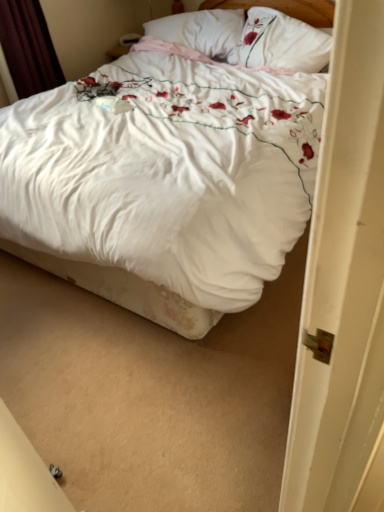
Question: Considering the relative sizes of white floral duvet at center and dark red velvet curtain at upper left in the image provided, is white floral duvet at center shorter than dark red velvet curtain at upper left?

Choices:
 (A) yes
 (B) no

Answer: (B)

Question: From the image's perspective, is white floral duvet at center beneath dark red velvet curtain at upper left?

Choices:
 (A) yes
 (B) no

Answer: (A)

Question: From the image's perspective, would you say white floral duvet at center is positioned over dark red velvet curtain at upper left?

Choices:
 (A) yes
 (B) no

Answer: (B)

Question: Is white floral duvet at center oriented away from dark red velvet curtain at upper left?

Choices:
 (A) yes
 (B) no

Answer: (B)

Question: Is white floral duvet at center positioned before dark red velvet curtain at upper left?

Choices:
 (A) yes
 (B) no

Answer: (A)

Question: Considering their positions, is white soft pillow at upper center, which is the 1th pillow in left-to-right order, located in front of or behind white floral pillow at upper center, placed as the first pillow when sorted from right to left?

Choices:
 (A) front
 (B) behind

Answer: (B)

Question: From the image's perspective, is white soft pillow at upper center, which is the 1th pillow in left-to-right order, above or below white floral pillow at upper center, which ranks as the second pillow in left-to-right order?

Choices:
 (A) below
 (B) above

Answer: (B)

Question: Is white soft pillow at upper center, which is the 1th pillow in left-to-right order, bigger or smaller than white floral pillow at upper center, placed as the first pillow when sorted from right to left?

Choices:
 (A) small
 (B) big

Answer: (B)

Question: Is white soft pillow at upper center, which is the 1th pillow in left-to-right order, to the left or to the right of white floral pillow at upper center, placed as the first pillow when sorted from right to left, in the image?

Choices:
 (A) right
 (B) left

Answer: (B)

Question: Considering the positions of white soft pillow at upper center, which is the 1th pillow in left-to-right order, and dark red velvet curtain at upper left in the image, is white soft pillow at upper center, which is the 1th pillow in left-to-right order, bigger or smaller than dark red velvet curtain at upper left?

Choices:
 (A) small
 (B) big

Answer: (A)

Question: From a real-world perspective, is white soft pillow at upper center, which is the 1th pillow in left-to-right order, positioned above or below dark red velvet curtain at upper left?

Choices:
 (A) above
 (B) below

Answer: (B)

Question: In terms of width, does white soft pillow at upper center, which is the 1th pillow in left-to-right order, look wider or thinner when compared to dark red velvet curtain at upper left?

Choices:
 (A) wide
 (B) thin

Answer: (A)

Question: Relative to dark red velvet curtain at upper left, is white soft pillow at upper center, which is the 1th pillow in left-to-right order, in front or behind?

Choices:
 (A) front
 (B) behind

Answer: (B)

Question: Considering the relative positions of white floral duvet at center and dark red velvet curtain at upper left in the image provided, is white floral duvet at center to the left or to the right of dark red velvet curtain at upper left?

Choices:
 (A) right
 (B) left

Answer: (A)

Question: From a real-world perspective, is white floral duvet at center physically located above or below dark red velvet curtain at upper left?

Choices:
 (A) below
 (B) above

Answer: (A)